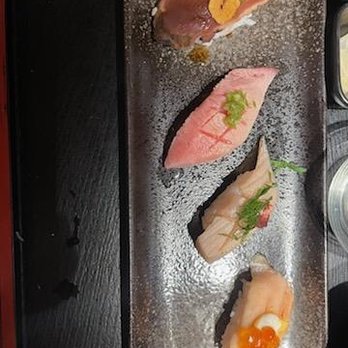
Find the location of a particular element. This screenshot has height=348, width=348. light is located at coordinates (225, 273).